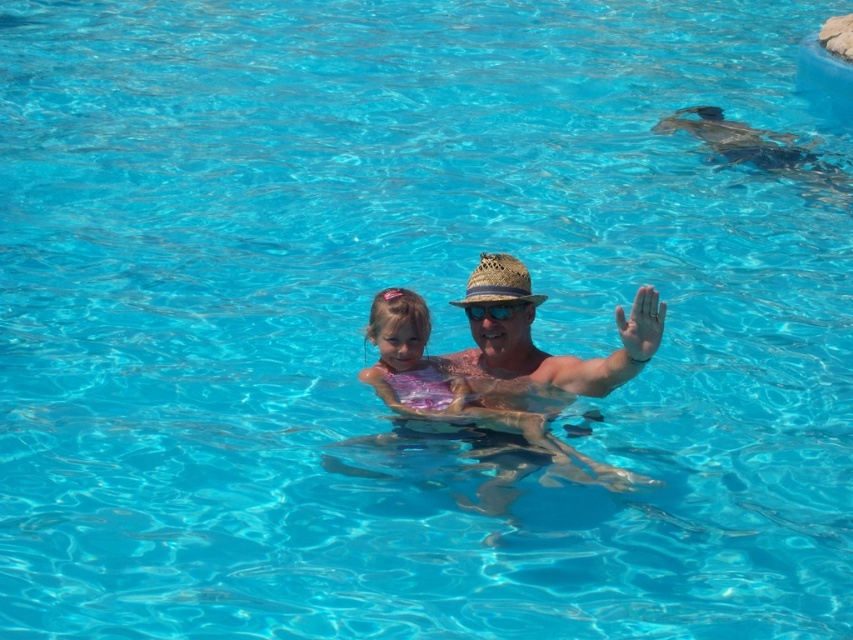
Who is more forward, (486, 360) or (642, 317)?

Point (642, 317) is more forward.

Does matte straw hat at center have a smaller size compared to matte skin palm at upper right?

No.

The width and height of the screenshot is (853, 640). I want to click on matte straw hat at center, so click(540, 349).

What are the coordinates of `matte straw hat at center` in the screenshot? It's located at (540, 349).

Does point (494, 269) lie behind point (479, 320)?

No.

Does straw hat at center have a lesser width compared to blue reflective plastic goggles at center?

Incorrect, straw hat at center's width is not less than blue reflective plastic goggles at center's.

Describe the element at coordinates (498, 282) in the screenshot. I see `straw hat at center` at that location.

Where is `straw hat at center`? The height and width of the screenshot is (640, 853). straw hat at center is located at coordinates (498, 282).

Can you confirm if straw hat at center is positioned below matte skin palm at upper right?

Actually, straw hat at center is above matte skin palm at upper right.

You are a GUI agent. You are given a task and a screenshot of the screen. Output one action in this format:
    pyautogui.click(x=<x>, y=<y>)
    Task: Click on the straw hat at center
    
    Given the screenshot: What is the action you would take?
    pyautogui.click(x=498, y=282)

This screenshot has height=640, width=853. Describe the element at coordinates (498, 282) in the screenshot. I see `straw hat at center` at that location.

Identify the location of straw hat at center. The width and height of the screenshot is (853, 640). (498, 282).